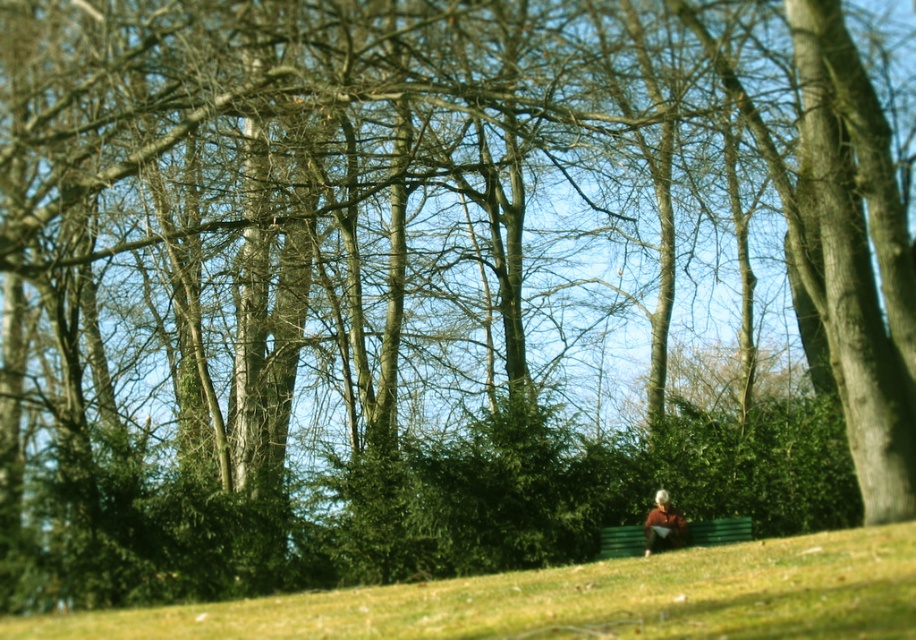
You are a photographer trying to capture the green grassy hillside at lower center and the blurred beige jacket at lower right in a single shot. Which object will occupy more space in the photo?

The green grassy hillside at lower center will occupy more space in the photo because it is bigger than the blurred beige jacket at lower right.

You are standing in the park and see the green wooden bench at lower center and the blurred beige jacket at lower right. Which object is closer to you?

The green wooden bench at lower center is closer to you because it is further to the viewer than the blurred beige jacket at lower right.

You are planning to set up a small picnic area in the image. Given the presence of the green grassy hillside at lower center and the green wooden bench at lower center, which object would provide more space for spreading a picnic blanket?

The green grassy hillside at lower center is bigger than the green wooden bench at lower center, so it would provide more space for spreading a picnic blanket.